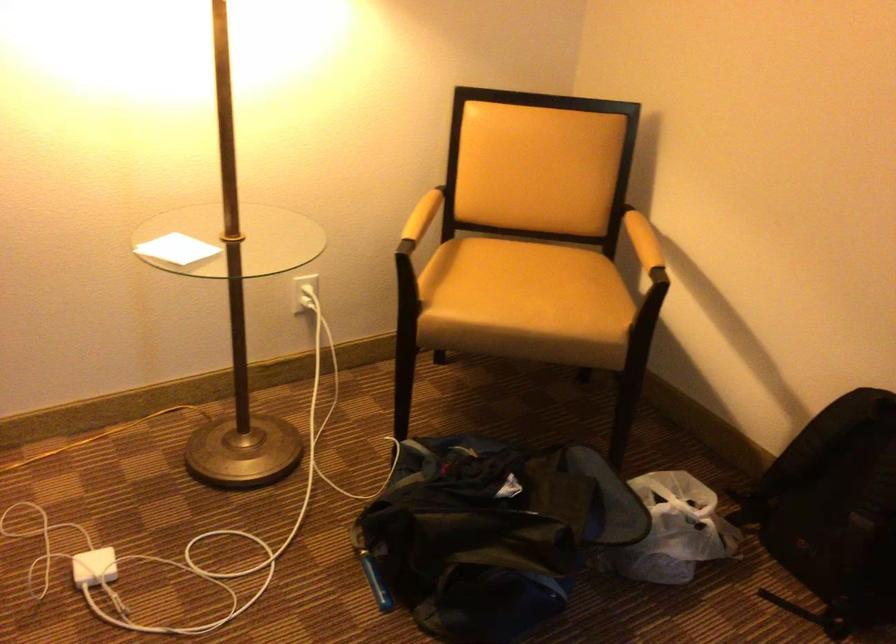
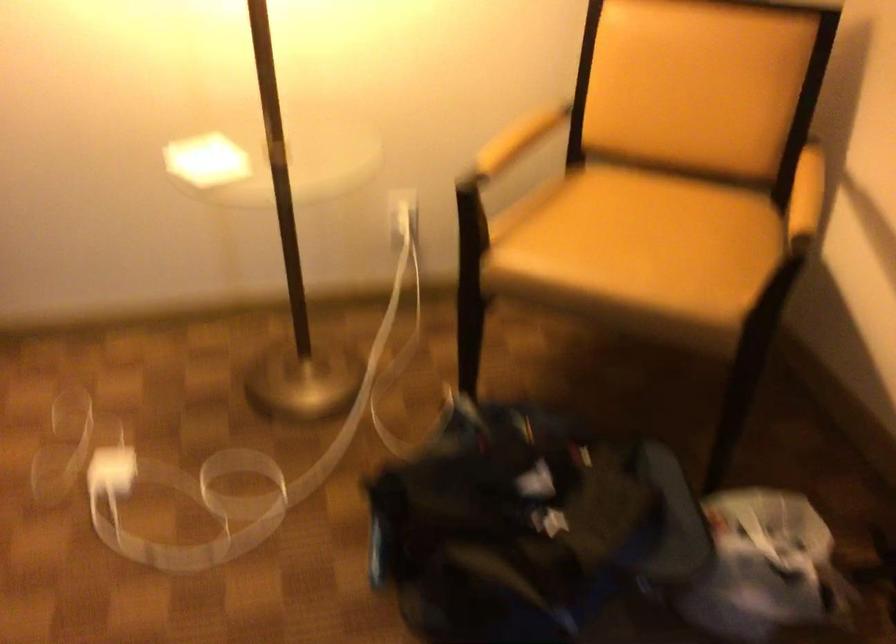
The images are taken continuously from a first-person perspective. In which direction are you moving?

The cameraman moved toward right, forward.